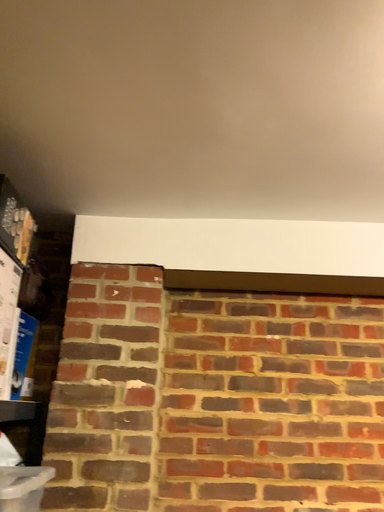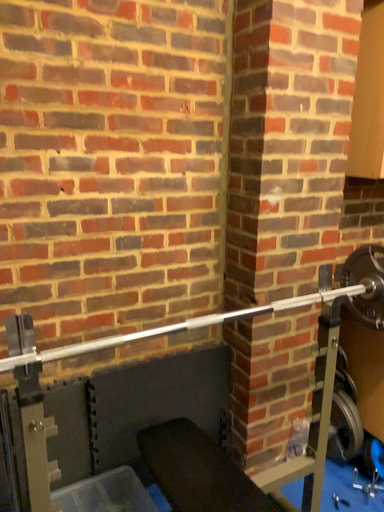
Question: How did the camera likely rotate when shooting the video?

Choices:
 (A) rotated upward
 (B) rotated downward

Answer: (B)